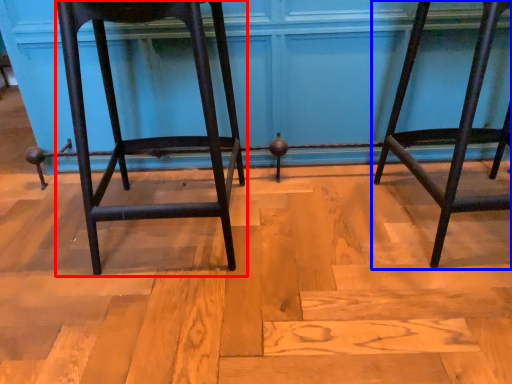
Question: Which object is closer to the camera taking this photo, furniture (highlighted by a red box) or furniture (highlighted by a blue box)?

Choices:
 (A) furniture
 (B) furniture

Answer: (A)